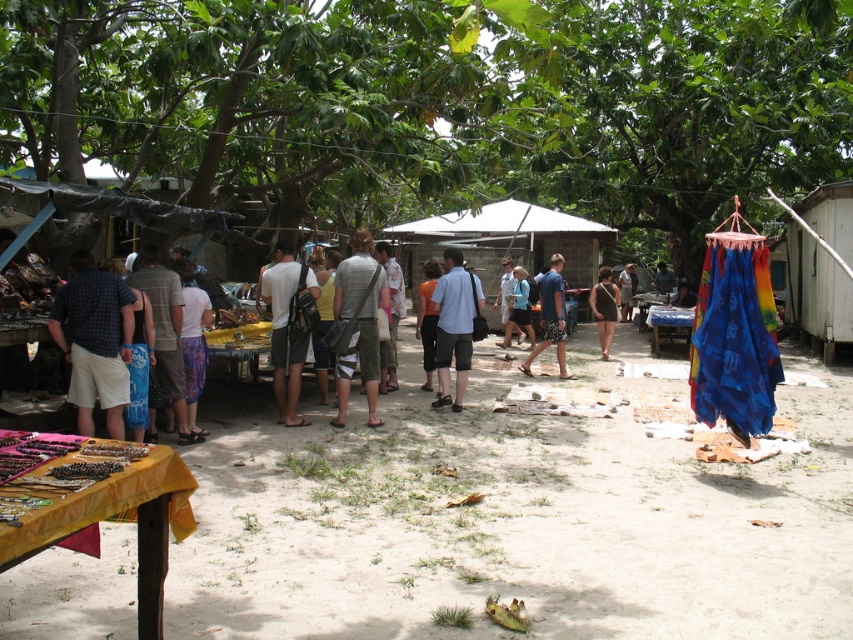
Does point (461, 252) come farther from viewer compared to point (605, 356)?

No, it is in front of (605, 356).

Between light blue fabric at center and black fabric dress at center, which one appears on the left side from the viewer's perspective?

From the viewer's perspective, light blue fabric at center appears more on the left side.

This screenshot has height=640, width=853. What do you see at coordinates (454, 326) in the screenshot?
I see `light blue fabric at center` at bounding box center [454, 326].

Where is `light blue fabric at center`? The height and width of the screenshot is (640, 853). light blue fabric at center is located at coordinates pos(454,326).

Is point (538, 284) closer to camera compared to point (608, 353)?

That is True.

Does blue printed shorts at center have a lesser width compared to black fabric dress at center?

In fact, blue printed shorts at center might be wider than black fabric dress at center.

Locate an element on the screen. The height and width of the screenshot is (640, 853). blue printed shorts at center is located at coordinates (550, 317).

The height and width of the screenshot is (640, 853). What are the coordinates of `blue printed shorts at center` in the screenshot? It's located at (550, 317).

Who is higher up, light gray fabric bag at center or light blue fabric at center?

light gray fabric bag at center is above.

Describe the element at coordinates (286, 330) in the screenshot. I see `light gray fabric bag at center` at that location.

Where is `light gray fabric bag at center`? This screenshot has width=853, height=640. light gray fabric bag at center is located at coordinates (286, 330).